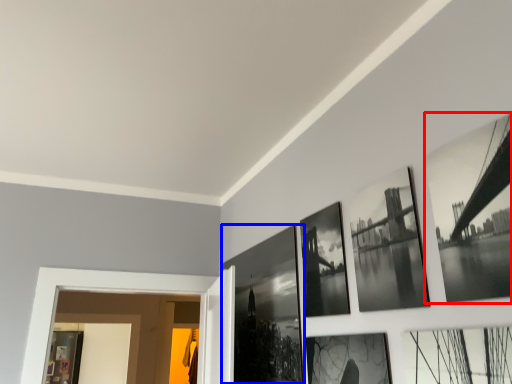
Question: Which object appears closest to the camera in this image, picture frame (highlighted by a red box) or picture frame (highlighted by a blue box)?

Choices:
 (A) picture frame
 (B) picture frame

Answer: (A)